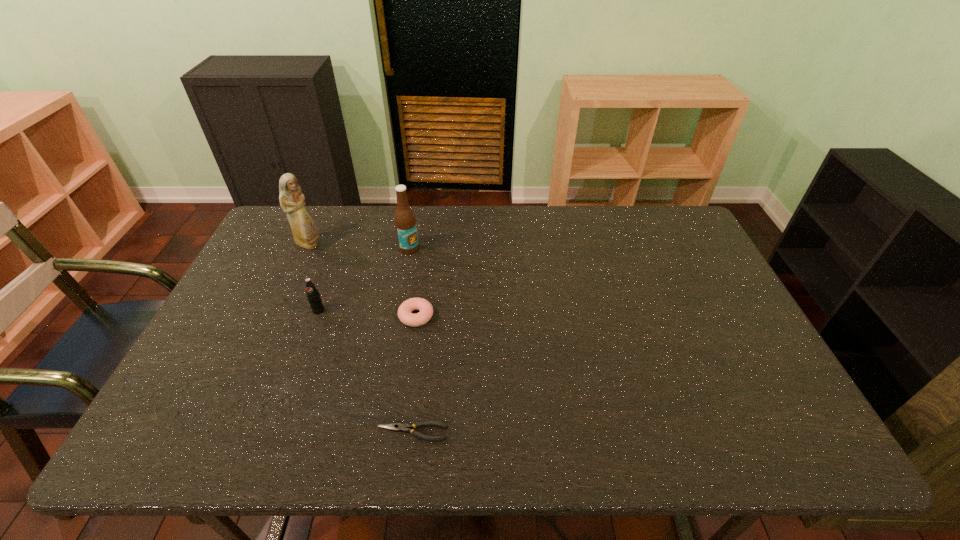
In the image, there is a desktop. Where is `vacant space at the right edge`? This screenshot has width=960, height=540. vacant space at the right edge is located at coordinates (732, 354).

In the image, there is a desktop. Where is `vacant space at the far right corner`? The width and height of the screenshot is (960, 540). vacant space at the far right corner is located at coordinates (676, 224).

Locate an element on the screen. free space between the leftmost object and the beer bottle is located at coordinates (359, 247).

Where is `blank region between the beer bottle and the second shortest object`? blank region between the beer bottle and the second shortest object is located at coordinates (x=413, y=282).

Locate an element on the screen. The image size is (960, 540). free space between the figurine and the doughnut is located at coordinates (363, 281).

At what (x,y) coordinates should I click in order to perform the action: click on free spot between the beer bottle and the figurine. Please return your answer as a coordinate pair (x, y). Image resolution: width=960 pixels, height=540 pixels. Looking at the image, I should click on (359, 247).

Where is `vacant area that lies between the beer bottle and the figurine`? This screenshot has width=960, height=540. vacant area that lies between the beer bottle and the figurine is located at coordinates (359, 247).

You are a GUI agent. You are given a task and a screenshot of the screen. Output one action in this format:
    pyautogui.click(x=<x>, y=<y>)
    Task: Click on the vacant region between the figurine and the doughnut
    
    Given the screenshot: What is the action you would take?
    pyautogui.click(x=363, y=281)

Locate an element on the screen. The image size is (960, 540). free area in between the third shortest object and the leftmost object is located at coordinates (314, 278).

The width and height of the screenshot is (960, 540). What are the coordinates of `empty location between the third shortest object and the beer bottle` in the screenshot? It's located at (364, 279).